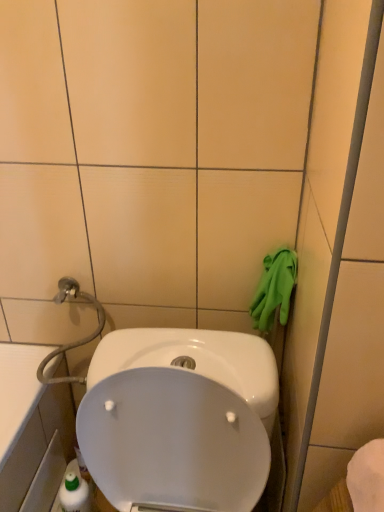
The width and height of the screenshot is (384, 512). What are the coordinates of `green rubber glove at right` in the screenshot? It's located at (340, 234).

What do you see at coordinates (340, 234) in the screenshot? Image resolution: width=384 pixels, height=512 pixels. I see `green rubber glove at right` at bounding box center [340, 234].

This screenshot has height=512, width=384. Find the location of `green rubber gloves at right`. green rubber gloves at right is located at coordinates (274, 289).

Describe the element at coordinates (274, 289) in the screenshot. Image resolution: width=384 pixels, height=512 pixels. I see `green rubber gloves at right` at that location.

This screenshot has width=384, height=512. In order to click on green rubber glove at right in this screenshot , I will do `click(340, 234)`.

Which object is positioned more to the right, green rubber gloves at right or green rubber glove at right?

green rubber glove at right.

Considering the positions of objects green rubber gloves at right and green rubber glove at right in the image provided, who is in front, green rubber gloves at right or green rubber glove at right?

green rubber glove at right is more forward.

Considering the points (258, 290) and (305, 418), which point is in front, point (258, 290) or point (305, 418)?

The point (305, 418) is closer to the camera.

From the image's perspective, which one is positioned higher, green rubber gloves at right or green rubber glove at right?

green rubber gloves at right, from the image's perspective.

From a real-world perspective, is green rubber gloves at right located higher than green rubber glove at right?

No, from a real-world perspective, green rubber gloves at right is not above green rubber glove at right.

Can you confirm if green rubber gloves at right is thinner than green rubber glove at right?

No.

Consider the image. Considering the relative sizes of green rubber gloves at right and green rubber glove at right in the image provided, is green rubber gloves at right taller than green rubber glove at right?

Incorrect, the height of green rubber gloves at right is not larger of that of green rubber glove at right.

Based on their sizes in the image, would you say green rubber gloves at right is bigger or smaller than green rubber glove at right?

green rubber gloves at right is smaller than green rubber glove at right.

Can green rubber glove at right be found inside green rubber gloves at right?

No, green rubber glove at right is located outside of green rubber gloves at right.

Are green rubber gloves at right and green rubber glove at right far apart?

green rubber gloves at right is near green rubber glove at right, not far away.

Is green rubber gloves at right facing towards green rubber glove at right?

No, green rubber gloves at right is not turned towards green rubber glove at right.

What's the angular difference between green rubber gloves at right and green rubber glove at right's facing directions?

green rubber gloves at right and green rubber glove at right are facing 0.311 degrees away from each other.

Where is `glass door that appears in front of the green rubber gloves at right`? This screenshot has width=384, height=512. glass door that appears in front of the green rubber gloves at right is located at coordinates (340, 234).

Which object is positioned more to the right, green rubber glove at right or green rubber gloves at right?

From the viewer's perspective, green rubber glove at right appears more on the right side.

Relative to green rubber gloves at right, is green rubber glove at right in front or behind?

green rubber glove at right is positioned closer to the viewer than green rubber gloves at right.

Which is closer, (351,136) or (287,267)?

Point (351,136) is positioned closer to the camera compared to point (287,267).

Consider the image. From the image's perspective, which one is positioned lower, green rubber glove at right or green rubber gloves at right?

green rubber glove at right appears lower in the image.

From a real-world perspective, which object rests below the other?

green rubber gloves at right, from a real-world perspective.

Can you confirm if green rubber glove at right is wider than green rubber gloves at right?

Incorrect, the width of green rubber glove at right does not surpass that of green rubber gloves at right.

Who is taller, green rubber glove at right or green rubber gloves at right?

With more height is green rubber glove at right.

In the scene shown: Between green rubber glove at right and green rubber gloves at right, which one has larger size?

Bigger between the two is green rubber glove at right.

Does green rubber glove at right contain green rubber gloves at right?

No, green rubber gloves at right is not inside green rubber glove at right.

Looking at this image, is green rubber glove at right not near green rubber gloves at right?

No, there isn't a large distance between green rubber glove at right and green rubber gloves at right.

Is green rubber glove at right facing towards green rubber gloves at right?

No, green rubber glove at right is not oriented towards green rubber gloves at right.

Looking at this image, what's the angular difference between green rubber glove at right and green rubber gloves at right's facing directions?

The angle between the facing direction of green rubber glove at right and the facing direction of green rubber gloves at right is 0.311 degrees.

How far apart are green rubber glove at right and green rubber gloves at right?

30.90 centimeters.

Identify the location of hand towel on the left of green rubber glove at right. (274, 289).

Locate an element on the screen. This screenshot has height=512, width=384. hand towel below the green rubber glove at right (from a real-world perspective) is located at coordinates (274, 289).

Image resolution: width=384 pixels, height=512 pixels. I want to click on hand towel to the left of green rubber glove at right, so click(274, 289).